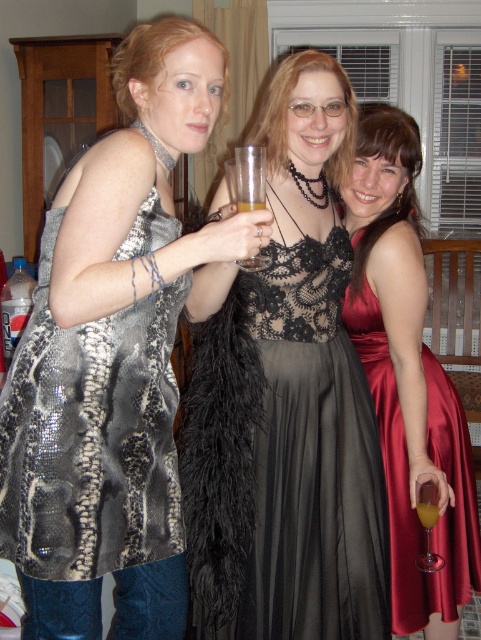
Does point (225, 372) lie behind point (455, 556)?

That is False.

The image size is (481, 640). Describe the element at coordinates (283, 460) in the screenshot. I see `lace fabric dress at center` at that location.

This screenshot has height=640, width=481. What are the coordinates of `lace fabric dress at center` in the screenshot? It's located at (283, 460).

Which is behind, point (257, 166) or point (423, 512)?

Positioned behind is point (423, 512).

Which of these two, translucent plastic cup at center or yellow translucent glass at center, stands taller?

translucent plastic cup at center is taller.

Find the location of a particular element. translucent plastic cup at center is located at coordinates (247, 179).

Does shiny metallic dress at center appear under yellow translucent glass at center?

No.

Locate an element on the screen. The width and height of the screenshot is (481, 640). shiny metallic dress at center is located at coordinates (113, 356).

Locate an element on the screen. shiny metallic dress at center is located at coordinates (113, 356).